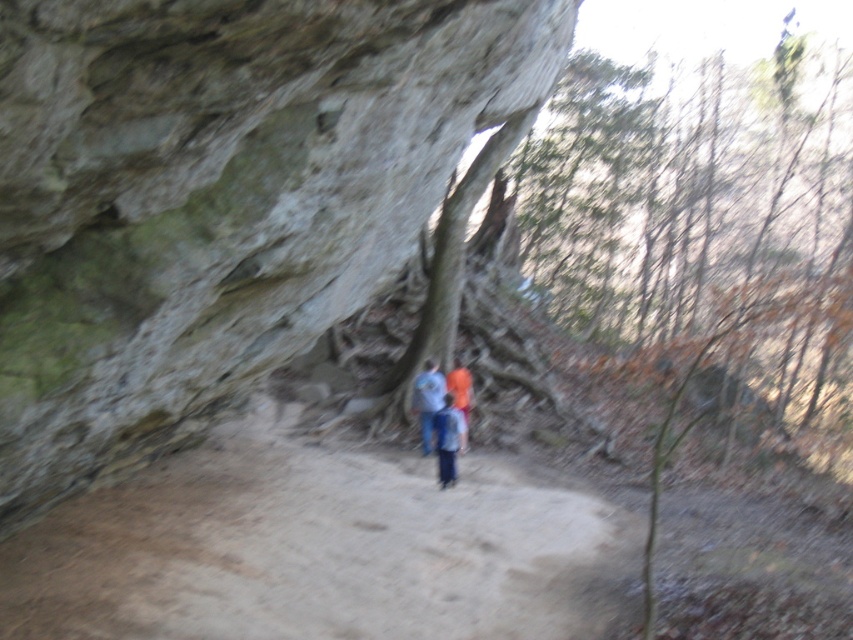
You are a hiker wearing a blue fabric shirt at center and an orange fabric at center. You want to know which piece of clothing covers more area on your body. Which one is larger?

The blue fabric shirt at center is bigger than orange fabric at center, so the blue fabric shirt at center covers more area on your body.

You are a hiker who has spotted the gray rough rock at center and the orange fabric at center in the image. Which object is positioned higher from the ground?

The gray rough rock at center is above the orange fabric at center, so the gray rough rock at center is positioned higher from the ground.